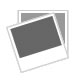
I want to click on polaroid instant picture, so click(x=56, y=46).